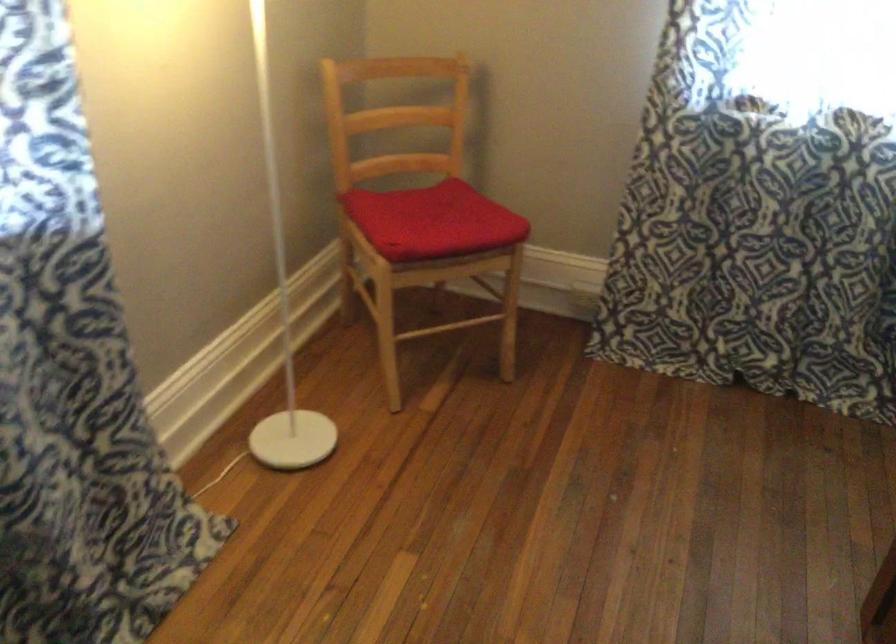
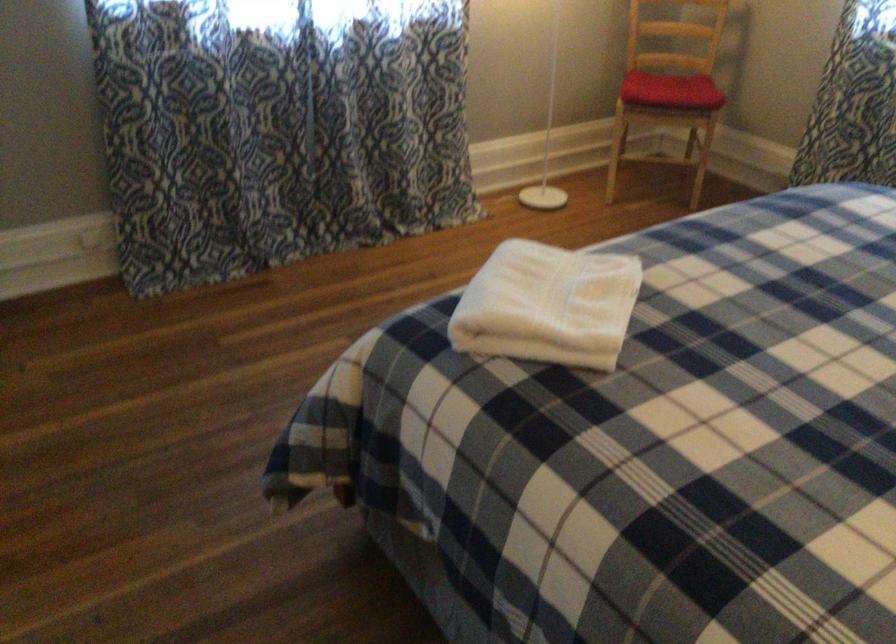
Find the pixel in the second image that matches pixel 448 239 in the first image.

(670, 90)